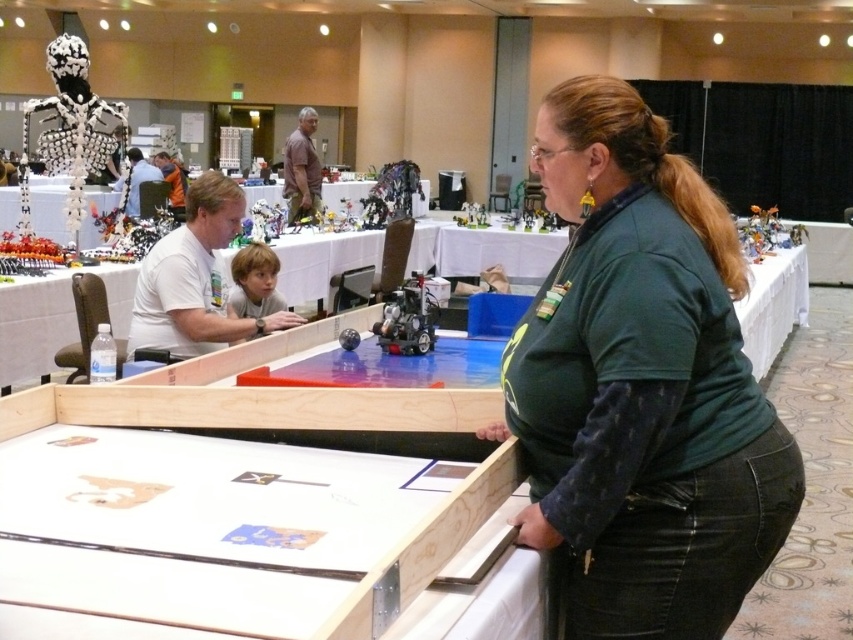
Does white matte shirt at center appear over brown shirt at center?

Actually, white matte shirt at center is below brown shirt at center.

Which is more to the left, white matte shirt at center or brown shirt at center?

brown shirt at center

Between point (259, 321) and point (283, 177), which one is positioned in front?

Positioned in front is point (259, 321).

The width and height of the screenshot is (853, 640). I want to click on white matte shirt at center, so click(x=194, y=280).

Is white matte shirt at center further to camera compared to matte white hair at upper left?

No.

Can you confirm if white matte shirt at center is positioned to the right of matte white hair at upper left?

Correct, you'll find white matte shirt at center to the right of matte white hair at upper left.

The width and height of the screenshot is (853, 640). What are the coordinates of `white matte shirt at center` in the screenshot? It's located at (194, 280).

Which is more to the left, green fabric shirt at center or light brown hair at center?

light brown hair at center

Does point (665, 531) come farther from viewer compared to point (276, 300)?

No, (665, 531) is closer to viewer.

You are a GUI agent. You are given a task and a screenshot of the screen. Output one action in this format:
    pyautogui.click(x=<x>, y=<y>)
    Task: Click on the green fabric shirt at center
    The width and height of the screenshot is (853, 640).
    Given the screenshot: What is the action you would take?
    pyautogui.click(x=641, y=387)